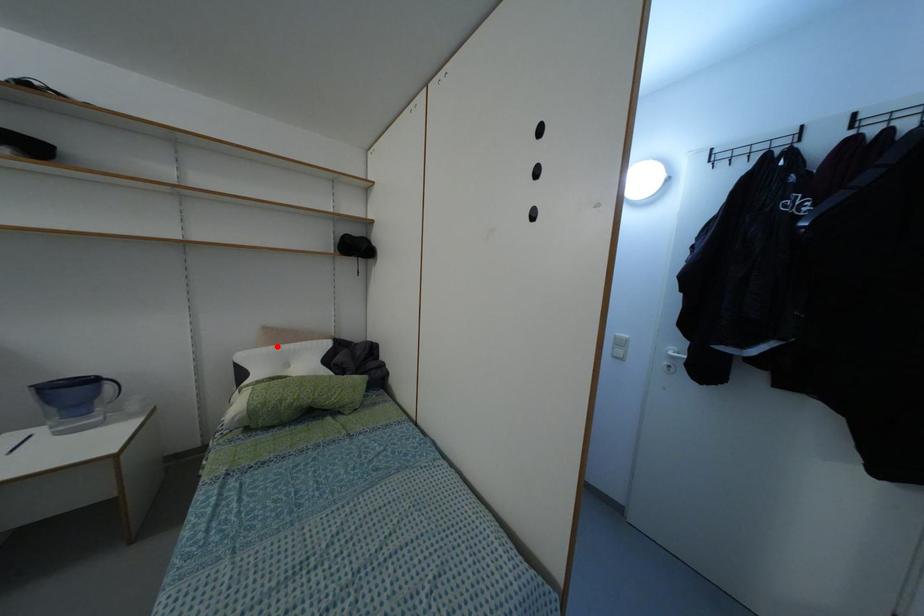
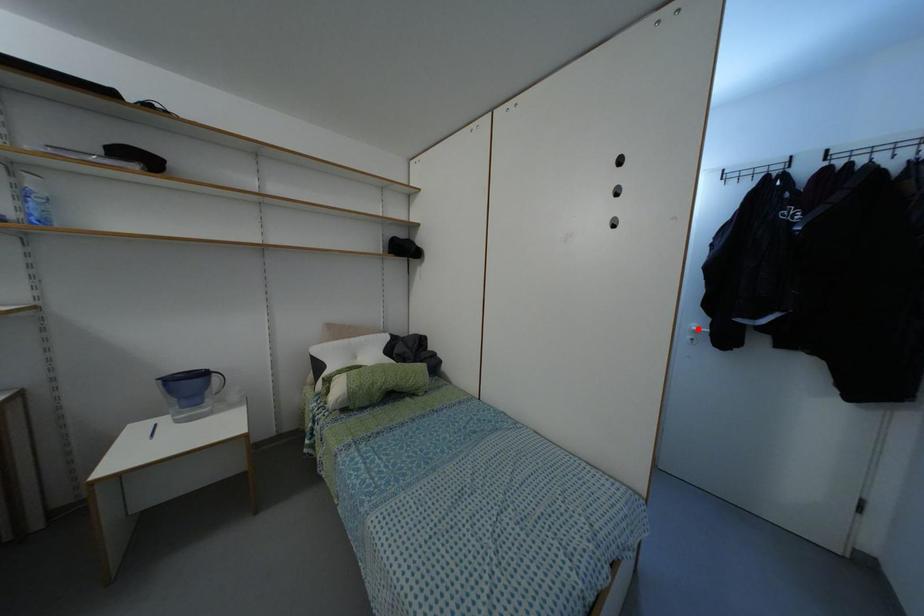
I am providing you with two images of the same scene from different viewpoints. A red point is marked on the first image and another point is marked on the second image. Is the marked point in image1 the same physical position as the marked point in image2?

No